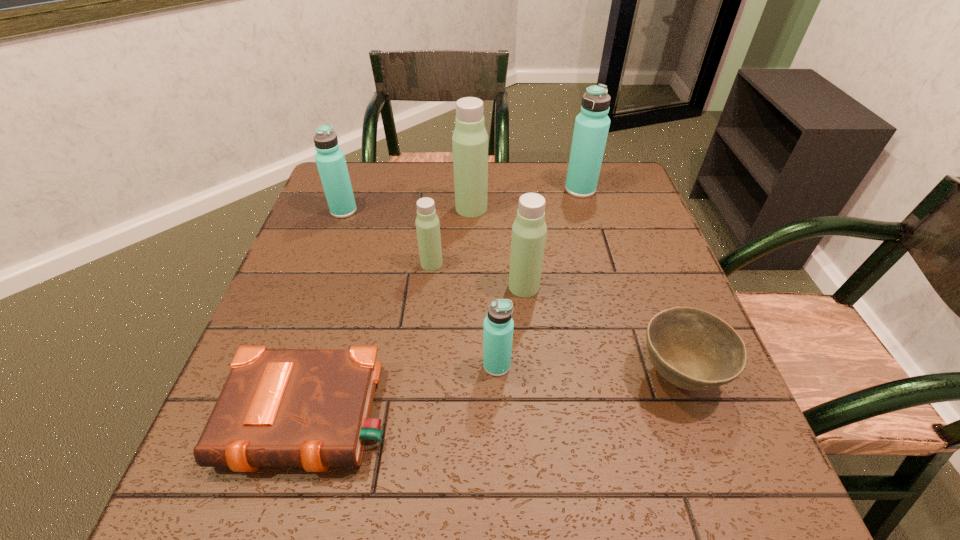
Find the location of `vacant space at the near edge`. vacant space at the near edge is located at coordinates (648, 506).

This screenshot has width=960, height=540. What are the coordinates of `free location at the left edge of the desktop` in the screenshot? It's located at pos(310,305).

This screenshot has height=540, width=960. Find the location of `blank space at the far left corner`. blank space at the far left corner is located at coordinates (371, 166).

Find the location of `vacant point at the near left corner`. vacant point at the near left corner is located at coordinates (287, 507).

The width and height of the screenshot is (960, 540). I want to click on free point at the far right corner, so click(609, 198).

You are a GUI agent. You are given a task and a screenshot of the screen. Output one action in this format:
    pyautogui.click(x=<x>, y=<y>)
    Task: Click on the free space between the leftmost aqua thermos bottle and the shortest object
    
    Given the screenshot: What is the action you would take?
    point(327,314)

Find the location of a particular element. This screenshot has height=540, width=960. vacant space that is in between the leftmost thermos bottle and the second aqua thermos bottle from right to left is located at coordinates (420, 288).

What are the coordinates of `unoccupied position between the nearest aqua thermos bottle and the second shortest object` in the screenshot? It's located at (588, 370).

This screenshot has width=960, height=540. I want to click on vacant space that's between the biggest light thermos bottle and the leftmost thermos bottle, so click(x=408, y=210).

Where is `unoccupied position between the rightmost aqua thermos bottle and the Bible`? The image size is (960, 540). unoccupied position between the rightmost aqua thermos bottle and the Bible is located at coordinates (445, 303).